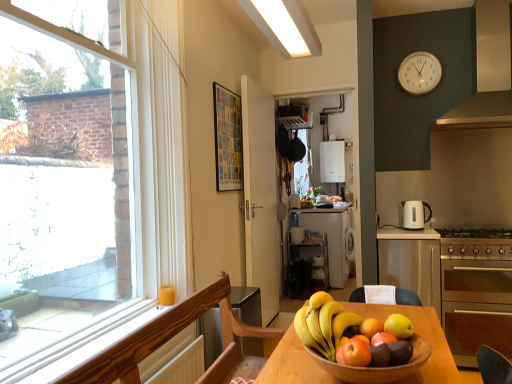
Question: Is white matte door at center closer to camera compared to shiny yellow apple at center, the sixth apple when ordered from front to back?

Choices:
 (A) no
 (B) yes

Answer: (A)

Question: Is white matte door at center directly adjacent to shiny yellow apple at center, the sixth apple when ordered from front to back?

Choices:
 (A) no
 (B) yes

Answer: (A)

Question: Does white matte door at center have a lesser width compared to shiny yellow apple at center, the first apple when ordered from back to front?

Choices:
 (A) yes
 (B) no

Answer: (B)

Question: From the image's perspective, is white matte door at center on top of shiny yellow apple at center, the sixth apple when ordered from front to back?

Choices:
 (A) no
 (B) yes

Answer: (B)

Question: Does white matte door at center have a lesser height compared to shiny yellow apple at center, the sixth apple when ordered from front to back?

Choices:
 (A) no
 (B) yes

Answer: (A)

Question: Considering their positions, is satin silver exhaust hood at upper right located in front of or behind white matte dishwasher at center?

Choices:
 (A) front
 (B) behind

Answer: (A)

Question: Considering the positions of satin silver exhaust hood at upper right and white matte dishwasher at center in the image, is satin silver exhaust hood at upper right taller or shorter than white matte dishwasher at center?

Choices:
 (A) tall
 (B) short

Answer: (B)

Question: From a real-world perspective, is satin silver exhaust hood at upper right above or below white matte dishwasher at center?

Choices:
 (A) below
 (B) above

Answer: (B)

Question: Looking at the image, does satin silver exhaust hood at upper right seem bigger or smaller compared to white matte dishwasher at center?

Choices:
 (A) big
 (B) small

Answer: (B)

Question: Relative to wooden bowl at center, is shiny yellow apple at center, the first apple when ordered from back to front, in front or behind?

Choices:
 (A) front
 (B) behind

Answer: (B)

Question: From a real-world perspective, is shiny yellow apple at center, the first apple when ordered from back to front, physically located above or below wooden bowl at center?

Choices:
 (A) below
 (B) above

Answer: (B)

Question: Considering the positions of shiny yellow apple at center, the sixth apple when ordered from front to back, and wooden bowl at center in the image, is shiny yellow apple at center, the sixth apple when ordered from front to back, taller or shorter than wooden bowl at center?

Choices:
 (A) short
 (B) tall

Answer: (A)

Question: From the image's perspective, relative to wooden bowl at center, is shiny yellow apple at center, the sixth apple when ordered from front to back, above or below?

Choices:
 (A) below
 (B) above

Answer: (B)

Question: Considering their positions, is shiny green apple at center, acting as the fifth apple starting from the back, located in front of or behind yellow matte apple at center, the 2th apple in the back-to-front sequence?

Choices:
 (A) behind
 (B) front

Answer: (B)

Question: In terms of size, does shiny green apple at center, the 2th apple in the front-to-back sequence, appear bigger or smaller than yellow matte apple at center, the fifth apple in the front-to-back sequence?

Choices:
 (A) small
 (B) big

Answer: (A)